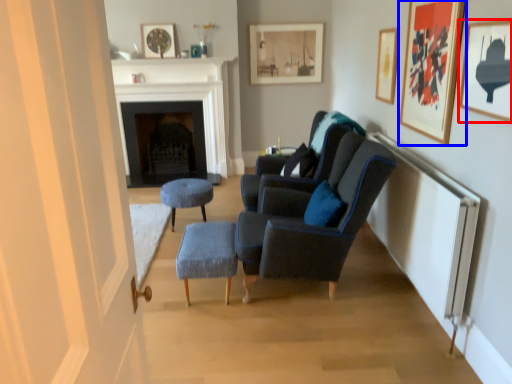
Question: Among these objects, which one is farthest to the camera, picture frame (highlighted by a red box) or picture frame (highlighted by a blue box)?

Choices:
 (A) picture frame
 (B) picture frame

Answer: (B)